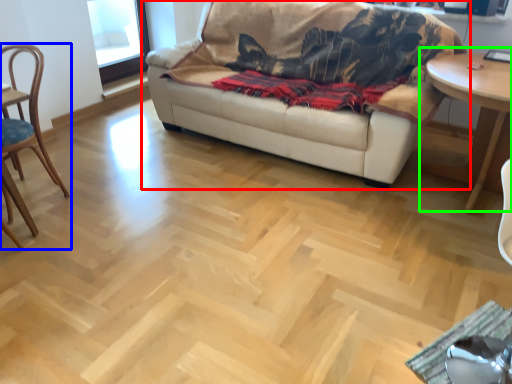
Question: Which is nearer to the studio couch (highlighted by a red box)? chair (highlighted by a blue box) or table (highlighted by a green box).

Choices:
 (A) chair
 (B) table

Answer: (B)